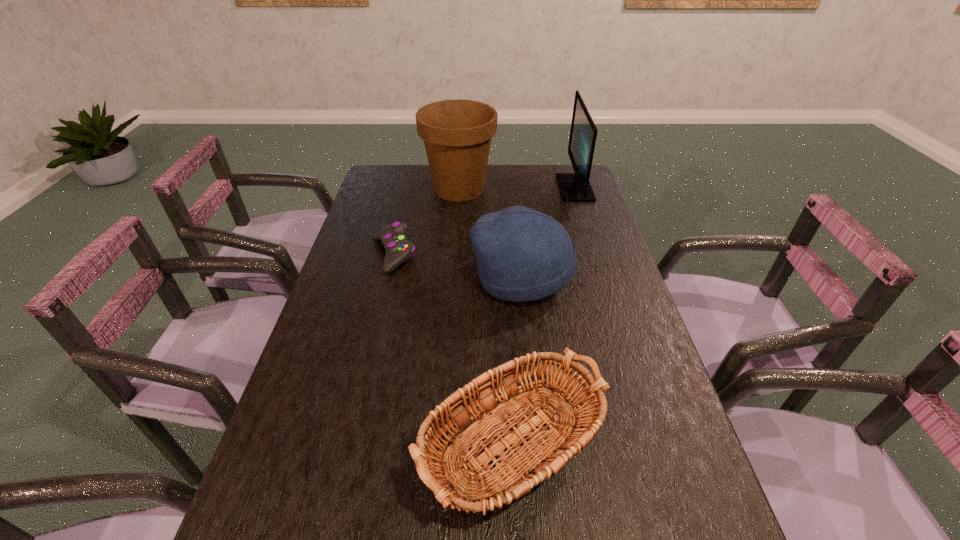
Where is `monitor located in the far edge section of the desktop`? The width and height of the screenshot is (960, 540). monitor located in the far edge section of the desktop is located at coordinates (574, 187).

This screenshot has height=540, width=960. Find the location of `flowerpot that is at the far edge`. flowerpot that is at the far edge is located at coordinates (457, 134).

Where is `object positioned at the left edge`? The height and width of the screenshot is (540, 960). object positioned at the left edge is located at coordinates (398, 249).

Find the location of a particular element. monitor located at the right edge is located at coordinates coord(574,187).

This screenshot has height=540, width=960. Find the location of `skullcap that is at the right edge`. skullcap that is at the right edge is located at coordinates (523, 255).

I want to click on object located at the far right corner, so click(x=574, y=187).

This screenshot has width=960, height=540. Identify the location of free space at the far edge of the desktop. (492, 174).

In the image, there is a desktop. Where is `blank space at the left edge`? blank space at the left edge is located at coordinates (283, 462).

Image resolution: width=960 pixels, height=540 pixels. I want to click on blank area at the right edge, so click(x=618, y=299).

Identify the location of free spot at the far left corner of the desktop. The height and width of the screenshot is (540, 960). (395, 173).